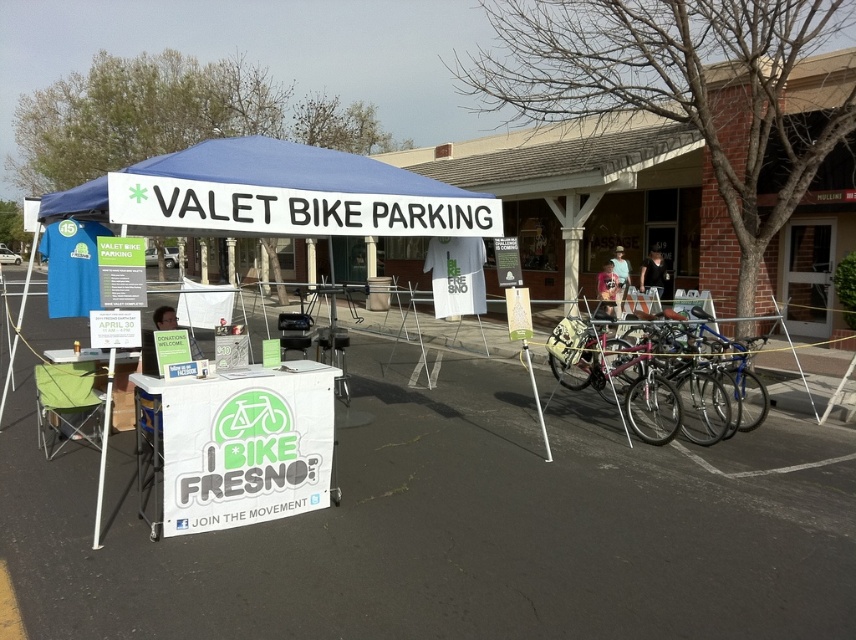
Question: Which of the following is the farthest from the observer?

Choices:
 (A) (617, 376)
 (B) (603, 276)

Answer: (B)

Question: Is silver metallic bicycle at right positioned in front of matte green signboard at center?

Choices:
 (A) yes
 (B) no

Answer: (B)

Question: Can you confirm if silver metallic bicycle at right is positioned above white plastic pole at lower left?

Choices:
 (A) no
 (B) yes

Answer: (B)

Question: Is blue fabric tent at center further to camera compared to matte green signboard at center?

Choices:
 (A) no
 (B) yes

Answer: (B)

Question: Estimate the real-world distances between objects in this image. Which object is farther from the blue fabric tent at center?

Choices:
 (A) matte green signboard at center
 (B) blue fabric canopy at center
 (C) white plastic pole at center

Answer: (C)

Question: Which of the following is the closest to the observer?

Choices:
 (A) matte green signboard at center
 (B) blue fabric canopy at center
 (C) blue fabric tent at center

Answer: (A)